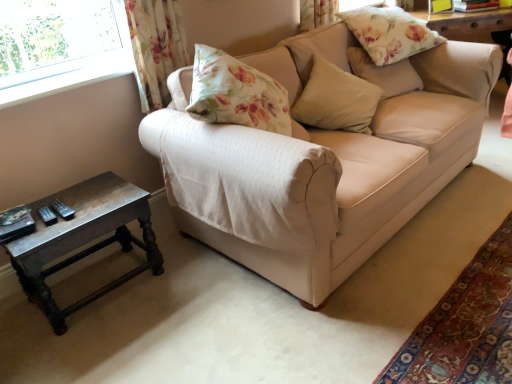
Identify the location of vacant area to the right of dark brown wooden table at lower left. (186, 284).